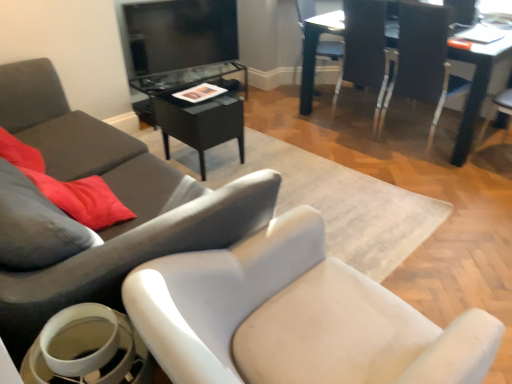
Question: Is light gray fabric chair at lower left, the 2th chair positioned from the left, bigger than black glass table at center, acting as the 2th table starting from the right?

Choices:
 (A) no
 (B) yes

Answer: (B)

Question: Can you see light gray fabric chair at lower left, the 2th chair positioned from the left, touching black glass table at center, acting as the 2th table starting from the right?

Choices:
 (A) yes
 (B) no

Answer: (B)

Question: Is the position of light gray fabric chair at lower left, which is counted as the fourth chair, starting from the right, more distant than that of black glass table at center, the first table when ordered from left to right?

Choices:
 (A) yes
 (B) no

Answer: (B)

Question: Does light gray fabric chair at lower left, which is counted as the fourth chair, starting from the right, lie in front of black glass table at center, the first table when ordered from left to right?

Choices:
 (A) yes
 (B) no

Answer: (A)

Question: Can you confirm if light gray fabric chair at lower left, the 2th chair positioned from the left, is smaller than black glass table at center, the first table when ordered from left to right?

Choices:
 (A) yes
 (B) no

Answer: (B)

Question: Is light gray fabric chair at lower left, which is counted as the fourth chair, starting from the right, positioned far away from black glass table at center, the first table when ordered from left to right?

Choices:
 (A) no
 (B) yes

Answer: (B)

Question: From a real-world perspective, is white plastic chair at upper right, the 3th chair when ordered from right to left, below light gray fabric chair at lower left, which is counted as the fourth chair, starting from the right?

Choices:
 (A) yes
 (B) no

Answer: (B)

Question: Is the surface of white plastic chair at upper right, the 3th chair from the left, in direct contact with light gray fabric chair at lower left, the 2th chair positioned from the left?

Choices:
 (A) yes
 (B) no

Answer: (B)

Question: From a real-world perspective, is white plastic chair at upper right, the 3th chair when ordered from right to left, on light gray fabric chair at lower left, the 2th chair positioned from the left?

Choices:
 (A) no
 (B) yes

Answer: (B)

Question: Can you confirm if white plastic chair at upper right, the 3th chair from the left, is positioned to the right of light gray fabric chair at lower left, the 2th chair positioned from the left?

Choices:
 (A) yes
 (B) no

Answer: (A)

Question: Is white plastic chair at upper right, the 3th chair from the left, bigger than light gray fabric chair at lower left, which is counted as the fourth chair, starting from the right?

Choices:
 (A) yes
 (B) no

Answer: (B)

Question: Is white plastic chair at upper right, the 3th chair when ordered from right to left, at the left side of light gray fabric chair at lower left, the 2th chair positioned from the left?

Choices:
 (A) no
 (B) yes

Answer: (A)

Question: Considering the relative positions of white plastic chair at upper right, marked as the 5th chair in a left-to-right arrangement, and white plastic chair at upper right, the 3th chair from the left, in the image provided, is white plastic chair at upper right, marked as the 5th chair in a left-to-right arrangement, to the right of white plastic chair at upper right, the 3th chair from the left, from the viewer's perspective?

Choices:
 (A) no
 (B) yes

Answer: (B)